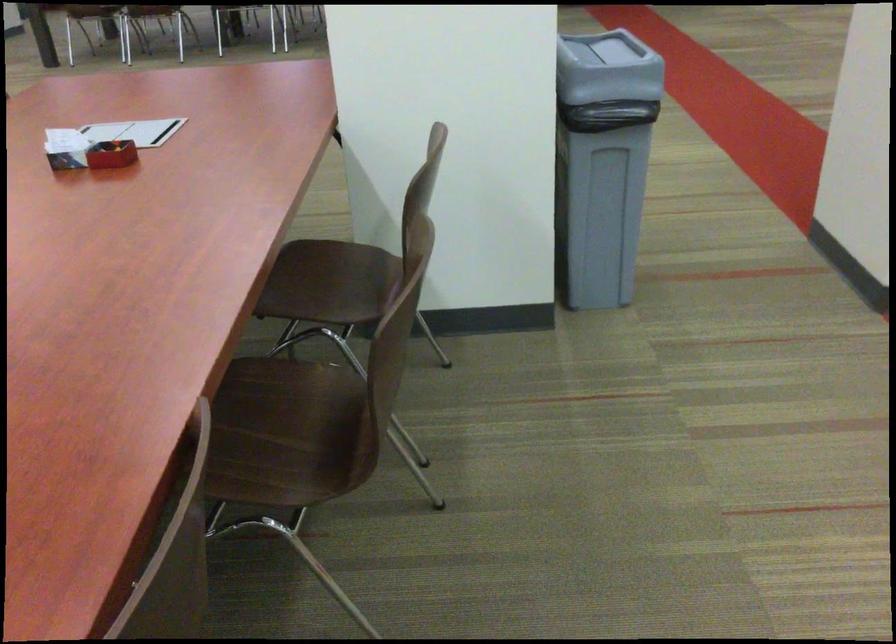
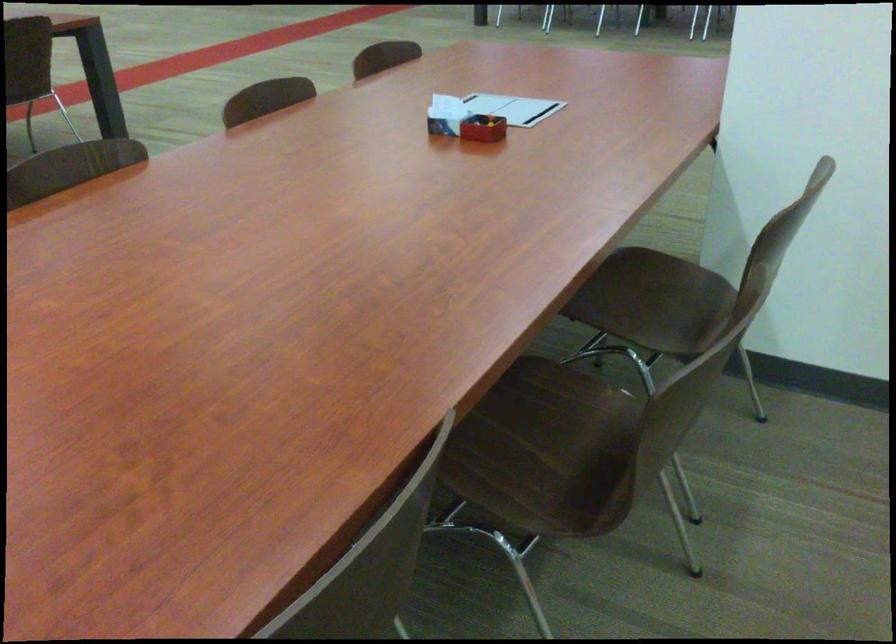
Locate, in the second image, the point that corresponds to point (271, 422) in the first image.

(541, 428)